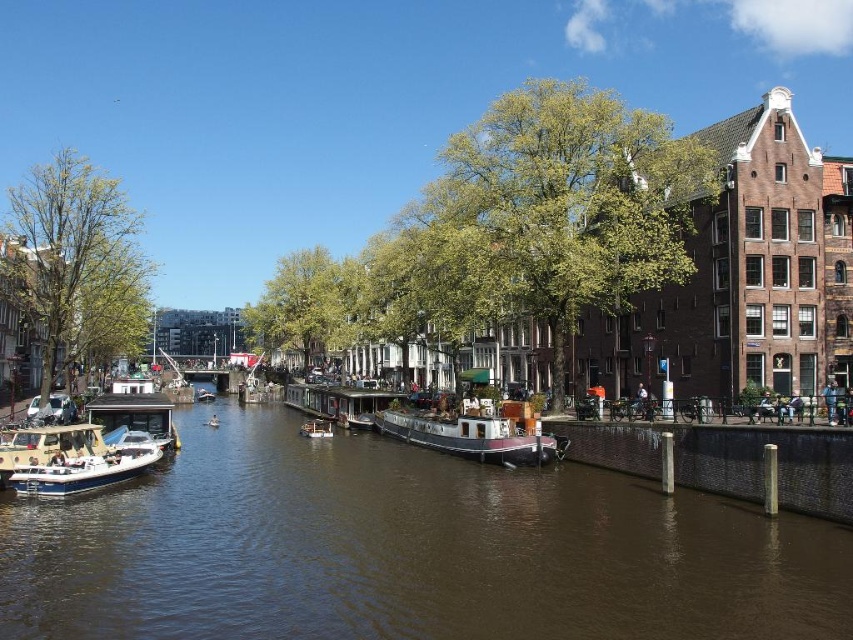
You are standing on the dock and see the white glossy boat at lower left and the metallic polished boat at center. Which boat is closer to your left side?

The white glossy boat at lower left is closer to your left side because it is positioned to the left of the metallic polished boat at center.

You are standing on the dock near the white glossy boat at lower left and want to reach the white glossy houseboat at center. The maximum distance you can walk is 35 meters. Can you reach it without using any water transportation?

The white glossy boat at lower left is 36.07 meters from the white glossy houseboat at center. Since the maximum distance you can walk is 35 meters, you cannot reach the white glossy houseboat at center without using water transportation.